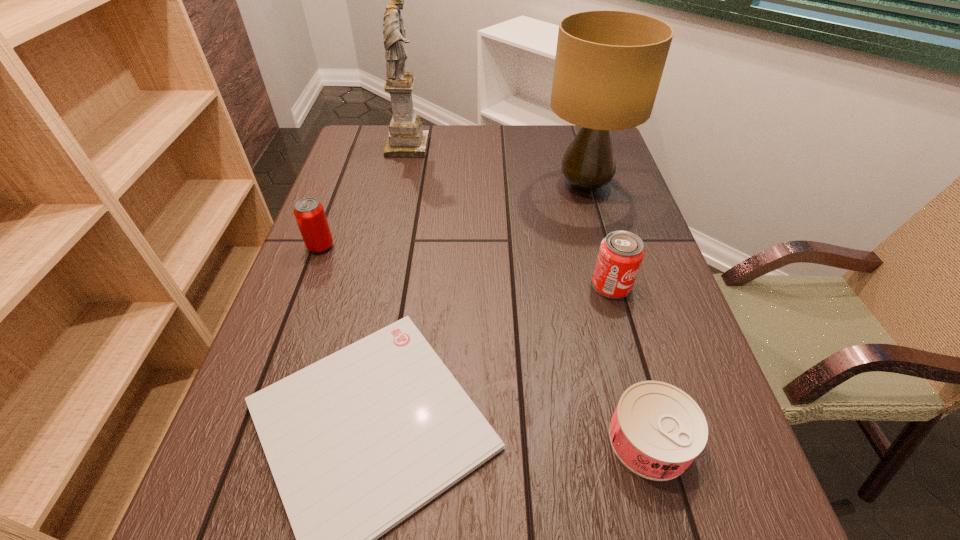
At what (x,y) coordinates should I click in order to perform the action: click on the farthest object. Please return your answer as a coordinate pair (x, y). Looking at the image, I should click on (406, 138).

Identify the location of lampshade. This screenshot has width=960, height=540. (608, 66).

Identify the location of the third nearest object. (621, 253).

What are the coordinates of `the leftmost can` in the screenshot? It's located at (309, 213).

Image resolution: width=960 pixels, height=540 pixels. Identify the location of the third farthest object. (309, 213).

You are a GUI agent. You are given a task and a screenshot of the screen. Output one action in this format:
    pyautogui.click(x=<x>, y=<y>)
    Task: Click on the shortest can
    
    Given the screenshot: What is the action you would take?
    pyautogui.click(x=657, y=430)

Find the location of `the fifth tallest object`. the fifth tallest object is located at coordinates (657, 430).

You are a GUI agent. You are given a task and a screenshot of the screen. Output one action in this format:
    pyautogui.click(x=<x>, y=<y>)
    Task: Click on the vacant point located on the front-facing side of the farthest object
    
    Given the screenshot: What is the action you would take?
    pyautogui.click(x=485, y=147)

Identify the location of vacant space located on the left of the lampshade. This screenshot has width=960, height=540. (398, 186).

In order to click on free space located 0.260m on the left of the second nearest can in this screenshot , I will do tap(473, 285).